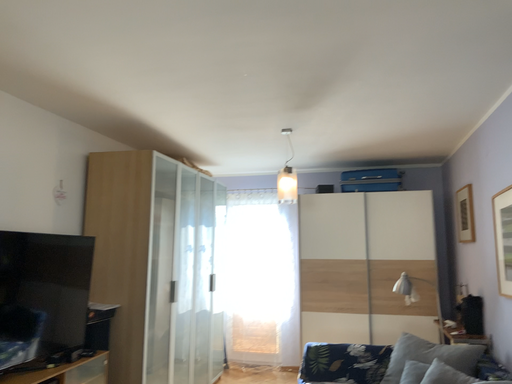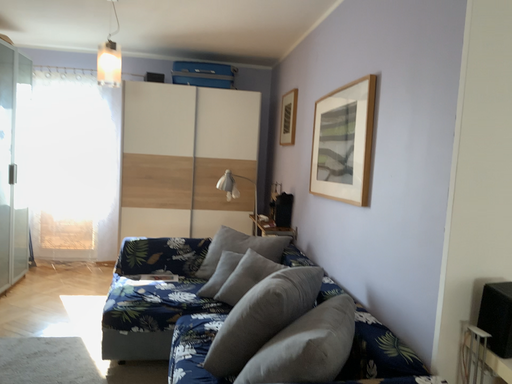
Question: How did the camera likely rotate when shooting the video?

Choices:
 (A) rotated upward
 (B) rotated downward

Answer: (B)